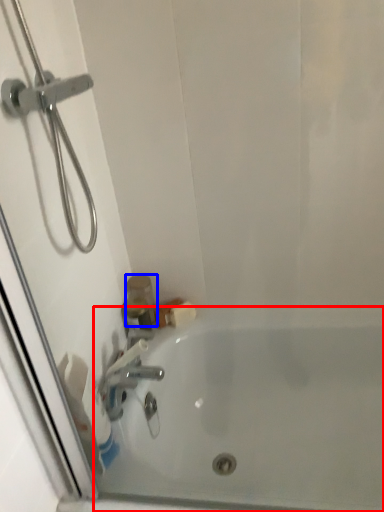
Question: Which point is closer to the camera, bathtub (highlighted by a red box) or toiletry (highlighted by a blue box)?

Choices:
 (A) bathtub
 (B) toiletry

Answer: (A)